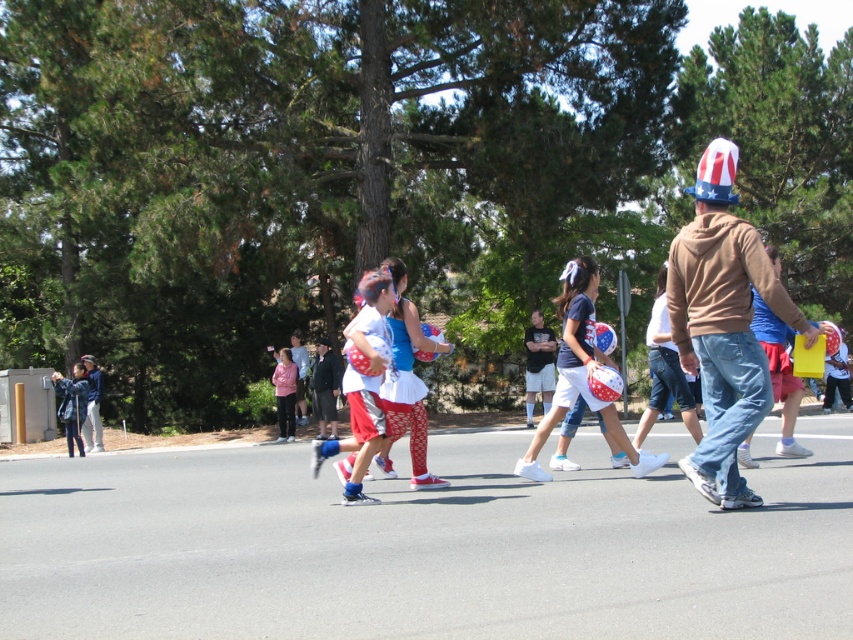
Can you confirm if brown hoodie at center is smaller than matte red helmet at center?

Indeed, brown hoodie at center has a smaller size compared to matte red helmet at center.

Which is behind, point (752, 380) or point (375, 332)?

Positioned behind is point (375, 332).

At what (x,y) coordinates should I click in order to perform the action: click on brown hoodie at center. Please return your answer as a coordinate pair (x, y). This screenshot has width=853, height=640. Looking at the image, I should click on (x=723, y=323).